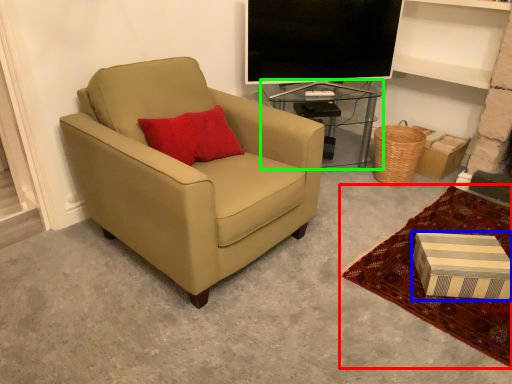
Question: Based on their relative distances, which object is nearer to plain (highlighted by a red box)? Choose from box (highlighted by a blue box) and table (highlighted by a green box).

Choices:
 (A) box
 (B) table

Answer: (A)